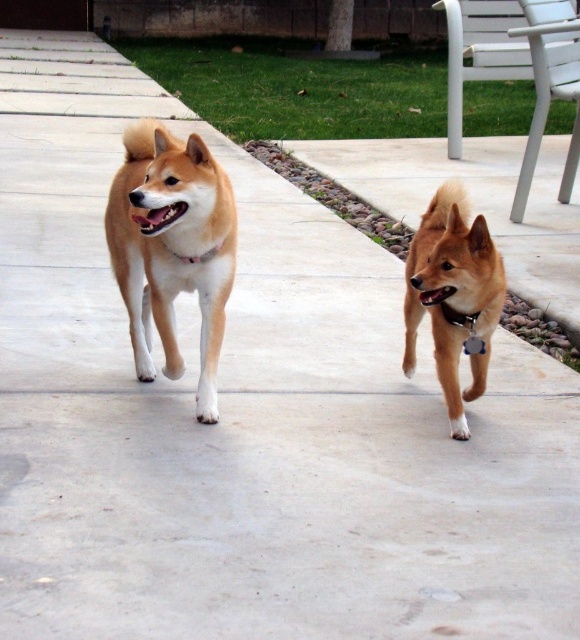
Question: Estimate the real-world distances between objects in this image. Which object is farther from the shiny brown fur at center?

Choices:
 (A) metallic silver tag at right
 (B) golden fur dog at center

Answer: (B)

Question: Considering the relative positions of shiny brown fur at center and metallic silver tag at right in the image provided, where is shiny brown fur at center located with respect to metallic silver tag at right?

Choices:
 (A) below
 (B) above

Answer: (B)

Question: Among these points, which one is nearest to the camera?

Choices:
 (A) (154, 157)
 (B) (473, 365)
 (C) (473, 346)

Answer: (A)

Question: Does golden fur dog at center have a larger size compared to metallic silver tag at right?

Choices:
 (A) no
 (B) yes

Answer: (B)

Question: Estimate the real-world distances between objects in this image. Which object is closer to the shiny brown fur at center?

Choices:
 (A) golden fur dog at center
 (B) metallic silver tag at right

Answer: (B)

Question: Can you confirm if golden fur dog at center is positioned above shiny brown fur at center?

Choices:
 (A) yes
 (B) no

Answer: (A)